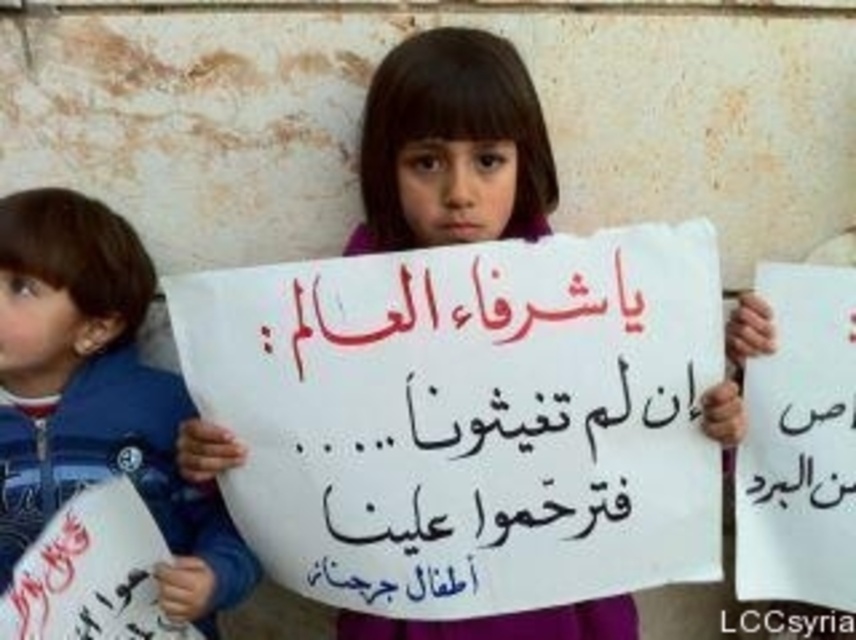
You are a photographer standing 6 feet away from the wall where the children are. You want to take a closeup photo of the white paper sign at center without moving the camera. Can you focus on it clearly?

The white paper sign at center is 5.16 feet away from the camera, which is within the photographer standing at 6 feet. Therefore, the photographer can focus on the white paper sign at center clearly without moving the camera.

You are a photographer trying to capture a clear shot of both the blue fleece jacket at left and the white paper at right. Considering their sizes, which object should you focus on first to ensure it fits in the frame without cropping?

The blue fleece jacket at left is larger in size than the white paper at right, so you should focus on ensuring the blue fleece jacket at left fits in the frame first to avoid cropping.

You are a photographer who needs to capture a clear shot of both the white paper sign at center and the white paper at right. Based on their sizes, which one should you focus on first to ensure it fits in the frame?

The white paper sign at center occupies less space than the white paper at right, so you should focus on capturing the white paper at right first since it is larger and requires more attention to fit properly in the frame.